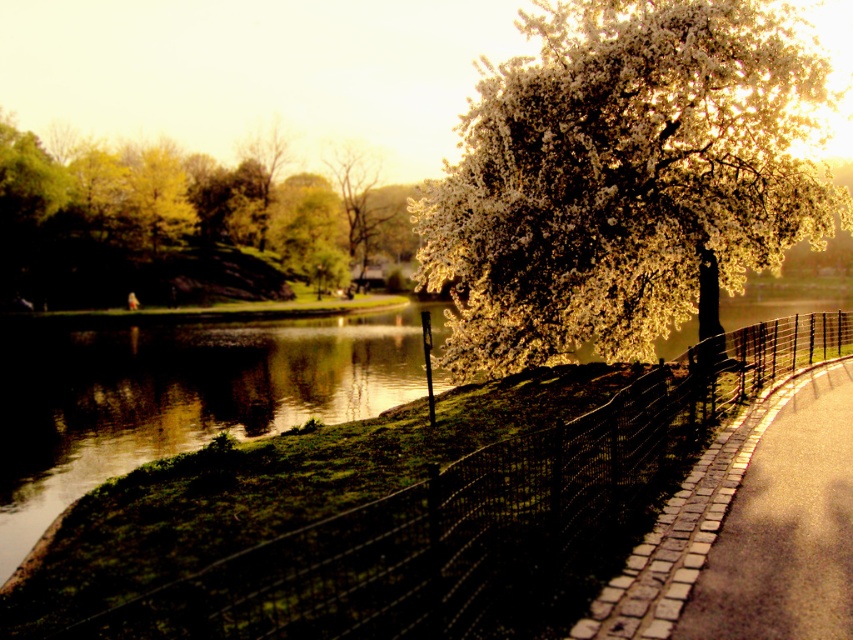
You are a park visitor who wants to take a photo of the green leafy tree at left and the smooth white blossoms at upper center. Which object is taller?

The green leafy tree at left is taller than the smooth white blossoms at upper center.

You are a landscape architect designing a new park. You need to place a large sculpture that requires a flat, open space. Based on the scene, which area would be more suitable for placing the sculpture? The green leafy tree at left or the brick paved path at center right?

The brick paved path at center right is more suitable for placing the large sculpture since it is a flat, open space, whereas the green leafy tree at left is much taller and likely has a root system that would make it unsuitable for such a structure.